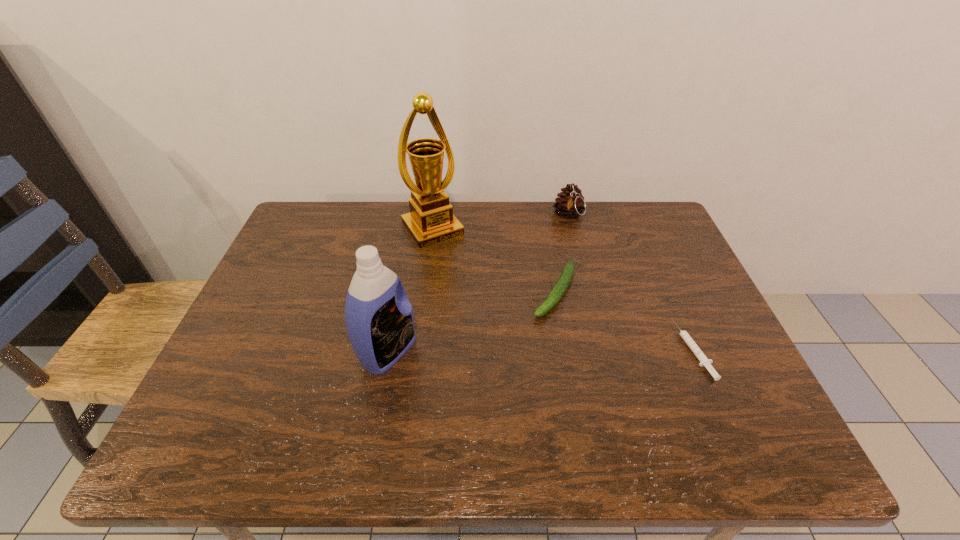
What are the coordinates of `syringe at the near edge` in the screenshot? It's located at (704, 361).

Identify the location of object that is at the right edge. Image resolution: width=960 pixels, height=540 pixels. (704, 361).

Image resolution: width=960 pixels, height=540 pixels. I want to click on object located at the near right corner, so click(704, 361).

This screenshot has height=540, width=960. Identify the location of free space at the far edge of the desktop. (554, 245).

This screenshot has width=960, height=540. In the image, there is a desktop. In order to click on vacant region at the near edge in this screenshot , I will do `click(299, 402)`.

Where is `vacant position at the left edge of the desktop`? The width and height of the screenshot is (960, 540). vacant position at the left edge of the desktop is located at coordinates [x=272, y=326].

The height and width of the screenshot is (540, 960). Identify the location of vacant space at the right edge of the desktop. (643, 292).

At what (x,y) coordinates should I click in order to perform the action: click on free location at the far left corner of the desktop. Please return your answer as a coordinate pair (x, y). This screenshot has height=540, width=960. Looking at the image, I should click on (293, 248).

The image size is (960, 540). Find the location of `blank space at the far right corner of the desktop`. blank space at the far right corner of the desktop is located at coordinates (635, 230).

I want to click on vacant space at the near right corner of the desktop, so click(x=733, y=391).